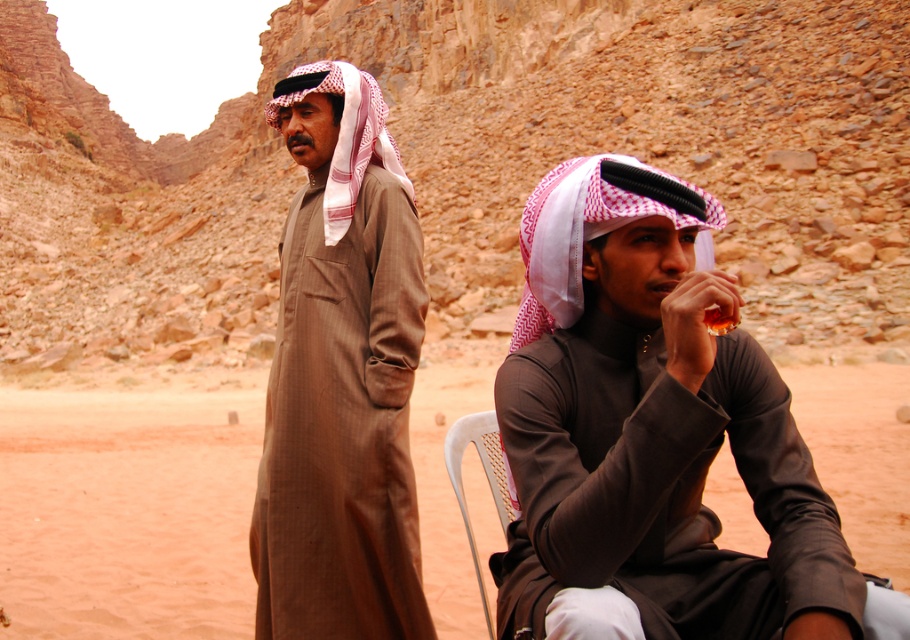
Question: Can you confirm if matte brown robe at center is positioned to the right of brown matte kandura at center?

Choices:
 (A) no
 (B) yes

Answer: (B)

Question: Considering the relative positions of matte brown robe at center and brown matte kandura at center in the image provided, where is matte brown robe at center located with respect to brown matte kandura at center?

Choices:
 (A) above
 (B) below

Answer: (B)

Question: Which is nearer to the white plastic chair at center?

Choices:
 (A) brown matte kandura at center
 (B) matte brown robe at center

Answer: (B)

Question: Which point is farther to the camera?

Choices:
 (A) white plastic chair at center
 (B) brown matte kandura at center
 (C) matte brown robe at center

Answer: (B)

Question: Can you confirm if brown matte kandura at center is smaller than white plastic chair at center?

Choices:
 (A) no
 (B) yes

Answer: (A)

Question: Estimate the real-world distances between objects in this image. Which object is closer to the brown matte kandura at center?

Choices:
 (A) matte brown robe at center
 (B) white plastic chair at center

Answer: (B)